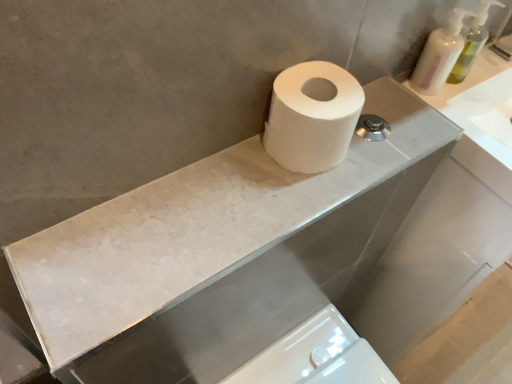
Find the location of `vacant area on top of white marble counter top at upper center (from a real-world perspective)`. vacant area on top of white marble counter top at upper center (from a real-world perspective) is located at coordinates (234, 196).